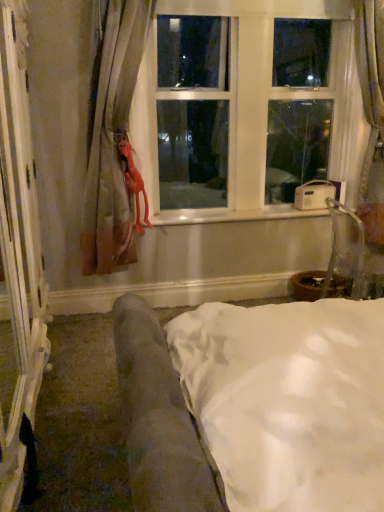
Question: Visually, is rubber orange at left positioned to the left or to the right of velvet fabric couch at lower left?

Choices:
 (A) left
 (B) right

Answer: (A)

Question: Which is correct: rubber orange at left is inside velvet fabric couch at lower left, or outside of it?

Choices:
 (A) inside
 (B) outside

Answer: (B)

Question: Which of these objects is positioned farthest from the matte beige curtain at left?

Choices:
 (A) white glossy screen door at left
 (B) rubber orange at left
 (C) clear plastic armchair at right
 (D) white plastic window at upper center
 (E) velvet fabric couch at lower left

Answer: (C)

Question: Which object is the closest to the velvet fabric couch at lower left?

Choices:
 (A) white plastic window at upper center
 (B) rubber orange at left
 (C) clear plastic armchair at right
 (D) matte beige curtain at left
 (E) white glossy screen door at left

Answer: (E)